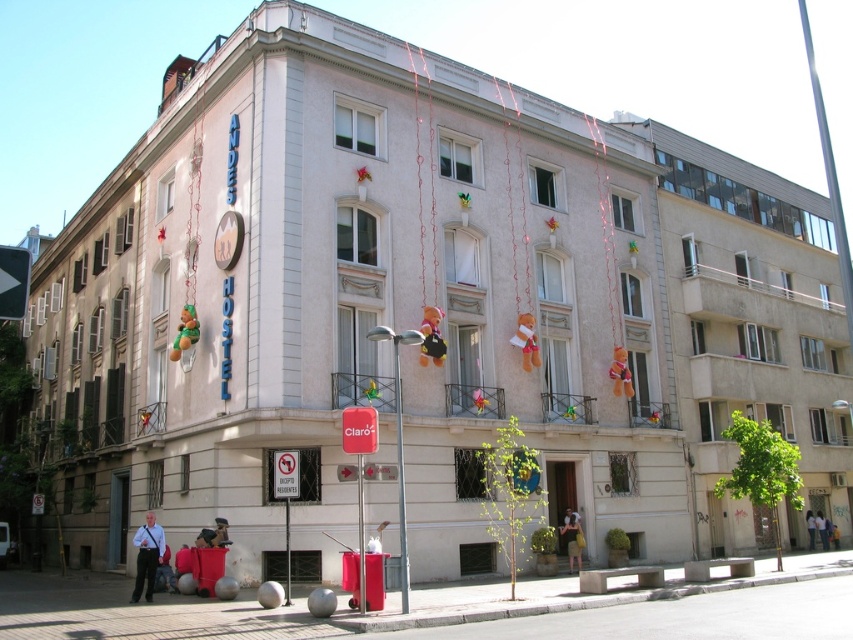
What are the coordinates of the white plastic sign at lower center?

The white plastic sign at lower center is located at coordinates point (285, 474).